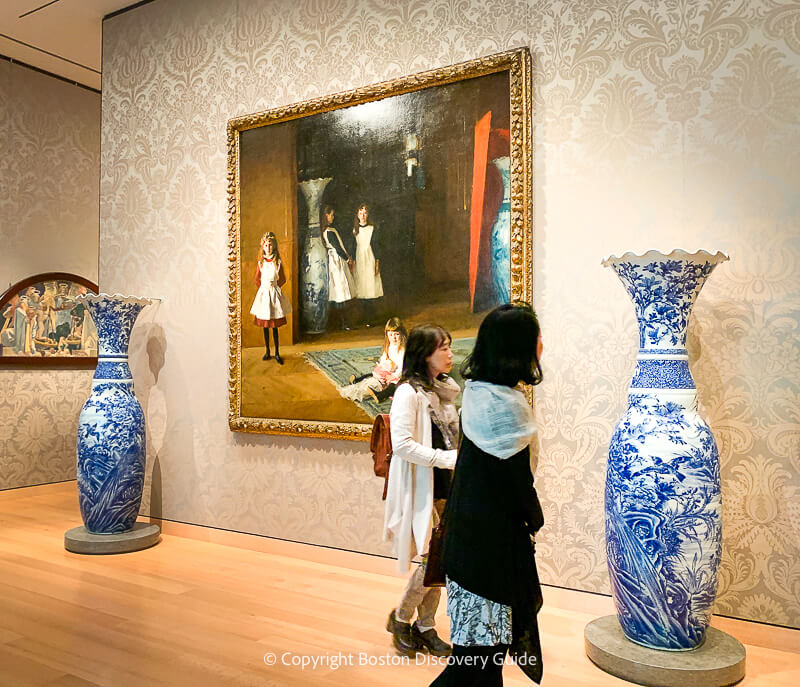
Find the location of a particular element. The width and height of the screenshot is (800, 687). vases is located at coordinates (665, 444), (502, 244), (314, 249), (106, 416).